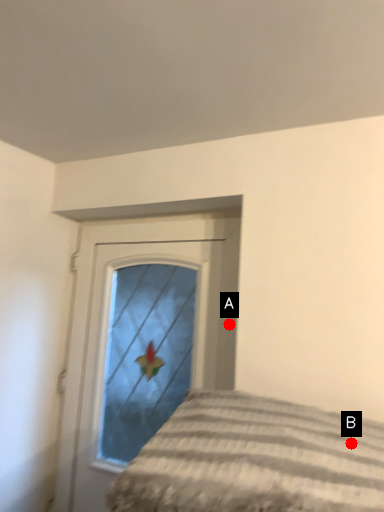
Question: Two points are circled on the image, labeled by A and B beside each circle. Which point appears farthest from the camera in this image?

Choices:
 (A) A is further
 (B) B is further

Answer: (A)